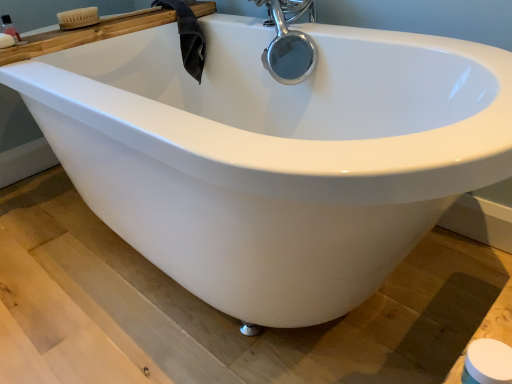
Question: Is translucent plastic bottle at upper left facing away from white matte toilet paper at lower right?

Choices:
 (A) no
 (B) yes

Answer: (A)

Question: Does translucent plastic bottle at upper left turn towards white matte toilet paper at lower right?

Choices:
 (A) yes
 (B) no

Answer: (B)

Question: Is translucent plastic bottle at upper left taller than white matte toilet paper at lower right?

Choices:
 (A) no
 (B) yes

Answer: (B)

Question: Considering the relative positions of translucent plastic bottle at upper left and white matte toilet paper at lower right in the image provided, is translucent plastic bottle at upper left to the right of white matte toilet paper at lower right from the viewer's perspective?

Choices:
 (A) yes
 (B) no

Answer: (B)

Question: Can you confirm if translucent plastic bottle at upper left is smaller than white matte toilet paper at lower right?

Choices:
 (A) no
 (B) yes

Answer: (B)

Question: Is woodenbrush at upper left situated inside white matte soap at upper left or outside?

Choices:
 (A) inside
 (B) outside

Answer: (B)

Question: Is point (73, 41) closer or farther from the camera than point (9, 39)?

Choices:
 (A) farther
 (B) closer

Answer: (A)

Question: Based on their positions, is woodenbrush at upper left located to the left or right of white matte soap at upper left?

Choices:
 (A) left
 (B) right

Answer: (B)

Question: In terms of width, does woodenbrush at upper left look wider or thinner when compared to white matte soap at upper left?

Choices:
 (A) thin
 (B) wide

Answer: (B)

Question: Is translucent plastic bottle at upper left bigger or smaller than white matte soap at upper left?

Choices:
 (A) small
 (B) big

Answer: (A)

Question: Choose the correct answer: Is translucent plastic bottle at upper left inside white matte soap at upper left or outside it?

Choices:
 (A) outside
 (B) inside

Answer: (A)

Question: From the image's perspective, is translucent plastic bottle at upper left positioned above or below white matte soap at upper left?

Choices:
 (A) below
 (B) above

Answer: (B)

Question: Considering the positions of translucent plastic bottle at upper left and white matte soap at upper left in the image, is translucent plastic bottle at upper left wider or thinner than white matte soap at upper left?

Choices:
 (A) thin
 (B) wide

Answer: (A)

Question: Considering the relative positions of white matte soap at upper left and white matte toilet paper at lower right in the image provided, is white matte soap at upper left to the left or to the right of white matte toilet paper at lower right?

Choices:
 (A) right
 (B) left

Answer: (B)

Question: In terms of size, does white matte soap at upper left appear bigger or smaller than white matte toilet paper at lower right?

Choices:
 (A) small
 (B) big

Answer: (A)